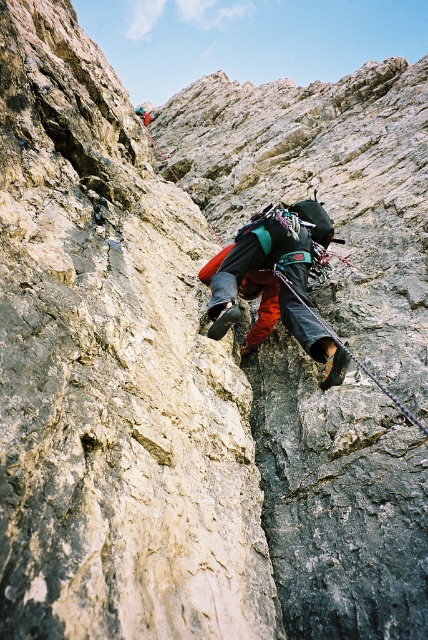
Question: Can you confirm if multicolored climbing gear at center is bigger than black nylon rope at center?

Choices:
 (A) no
 (B) yes

Answer: (A)

Question: Which object appears farthest from the camera in this image?

Choices:
 (A) multicolored climbing gear at center
 (B) black nylon rope at center

Answer: (A)

Question: Among these objects, which one is farthest from the camera?

Choices:
 (A) multicolored climbing gear at center
 (B) black nylon rope at center

Answer: (A)

Question: Does multicolored climbing gear at center appear on the right side of black nylon rope at center?

Choices:
 (A) yes
 (B) no

Answer: (B)

Question: In this image, where is multicolored climbing gear at center located relative to black nylon rope at center?

Choices:
 (A) below
 (B) above

Answer: (A)